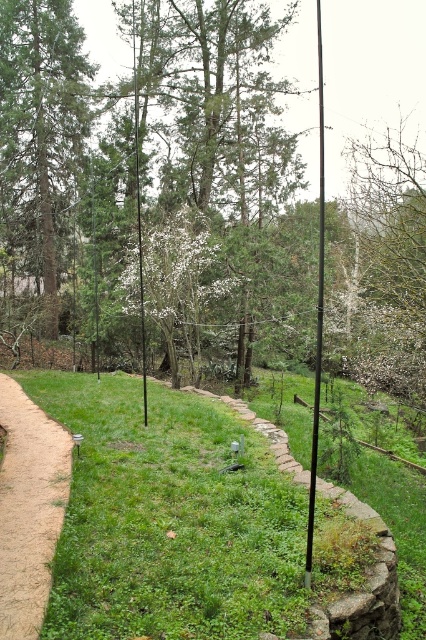
You are standing on the dirt path on the left side of the image and want to walk towards the green leafy tree at center. Which direction should you walk relative to the green matte tree at left?

To reach the green leafy tree at center from the dirt path on the left, you should walk towards the right side of the green matte tree at left because the green leafy tree at center is located below it.

You are standing on the dirt path and want to walk towards the white textured tree at center. Which direction should you walk relative to the green matte tree at left?

You should walk towards the right relative to the green matte tree at left because the white textured tree at center is positioned to the right of the green matte tree at left.